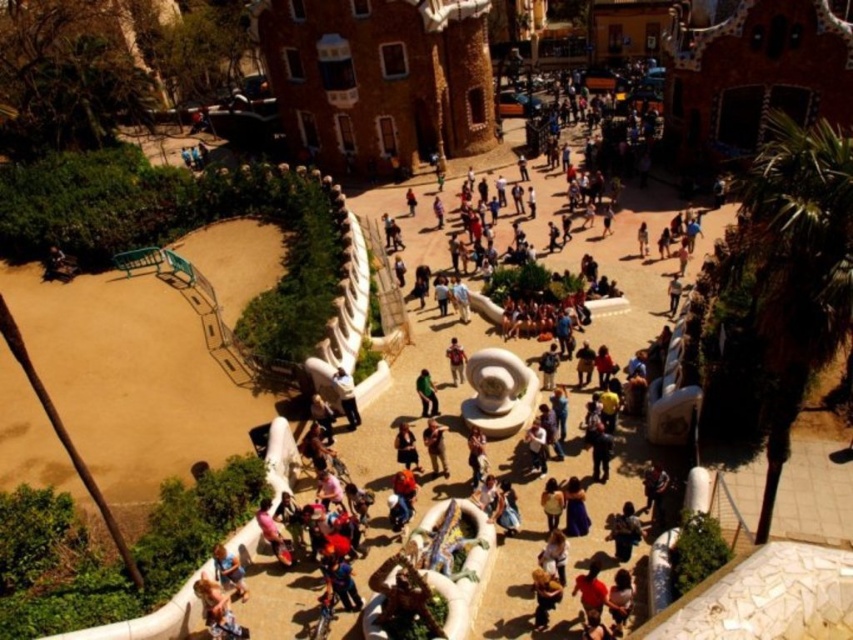
Can you confirm if brown leather jacket at center is positioned above light blue denim jeans at center?

No.

Looking at this image, who is more forward, (434, 452) or (352, 387)?

Point (434, 452)

Locate an element on the screen. This screenshot has height=640, width=853. brown leather jacket at center is located at coordinates (434, 445).

Can you confirm if green matte pants at center is thinner than matte brown backpack at center?

No, green matte pants at center is not thinner than matte brown backpack at center.

Between point (419, 397) and point (451, 378), which one is positioned in front?

Positioned in front is point (419, 397).

Between point (421, 390) and point (453, 349), which one is positioned behind?

The point (453, 349) is behind.

Locate an element on the screen. green matte pants at center is located at coordinates (426, 394).

Can you confirm if light blue denim jeans at center is smaller than green matte pants at center?

Actually, light blue denim jeans at center might be larger than green matte pants at center.

Is light blue denim jeans at center positioned behind green matte pants at center?

No, it is not.

Is point (335, 387) more distant than point (432, 416)?

No, it is in front of (432, 416).

Where is `light blue denim jeans at center`? light blue denim jeans at center is located at coordinates (346, 396).